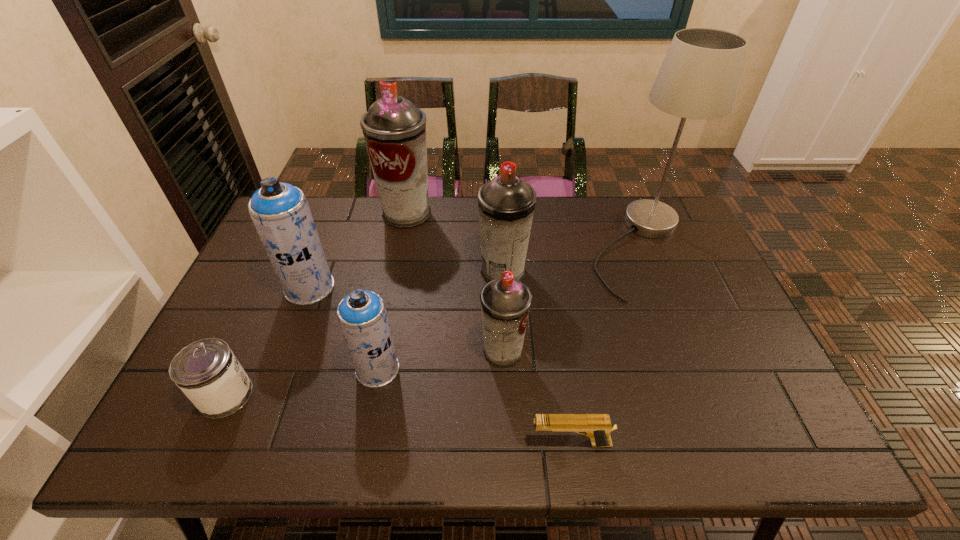
Where is `the rightmost object`? This screenshot has width=960, height=540. the rightmost object is located at coordinates (698, 79).

This screenshot has width=960, height=540. I want to click on white table lamp, so click(x=698, y=79).

Find the location of `the leftmost gray aerosol can`. the leftmost gray aerosol can is located at coordinates (394, 129).

Image resolution: width=960 pixels, height=540 pixels. I want to click on the farthest gray aerosol can, so click(x=394, y=129).

You are a GUI agent. You are given a task and a screenshot of the screen. Output one action in this format:
    pyautogui.click(x=<x>, y=<y>)
    Task: Click on the second smallest gray aerosol can
    
    Given the screenshot: What is the action you would take?
    pyautogui.click(x=506, y=204)

This screenshot has height=540, width=960. I want to click on the farther blue aerosol can, so click(280, 212).

This screenshot has height=540, width=960. In order to click on the left blue aerosol can in this screenshot , I will do `click(280, 212)`.

Where is `the right blue aerosol can`? This screenshot has width=960, height=540. the right blue aerosol can is located at coordinates (362, 316).

This screenshot has width=960, height=540. I want to click on the smaller blue aerosol can, so click(x=362, y=316).

Locate an element on the screen. This screenshot has width=960, height=540. the smallest gray aerosol can is located at coordinates (505, 302).